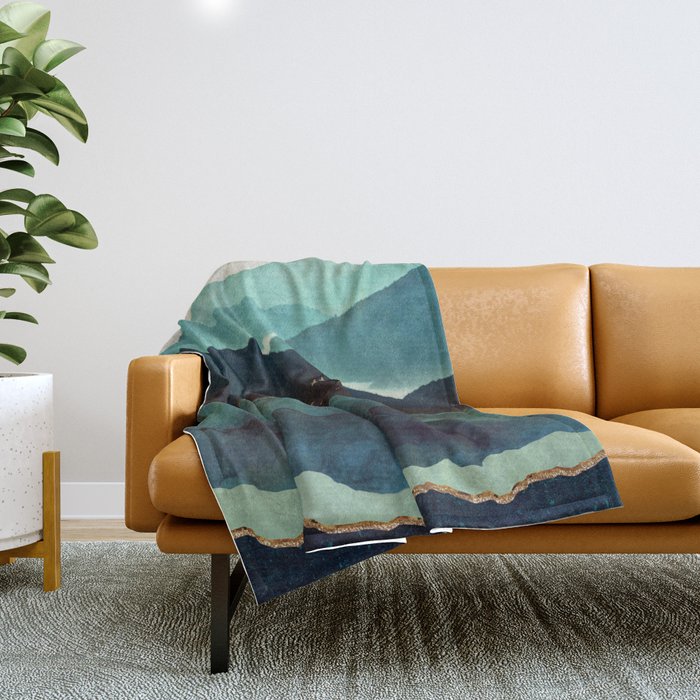
The height and width of the screenshot is (700, 700). Identify the location of leather couch. (553, 336).